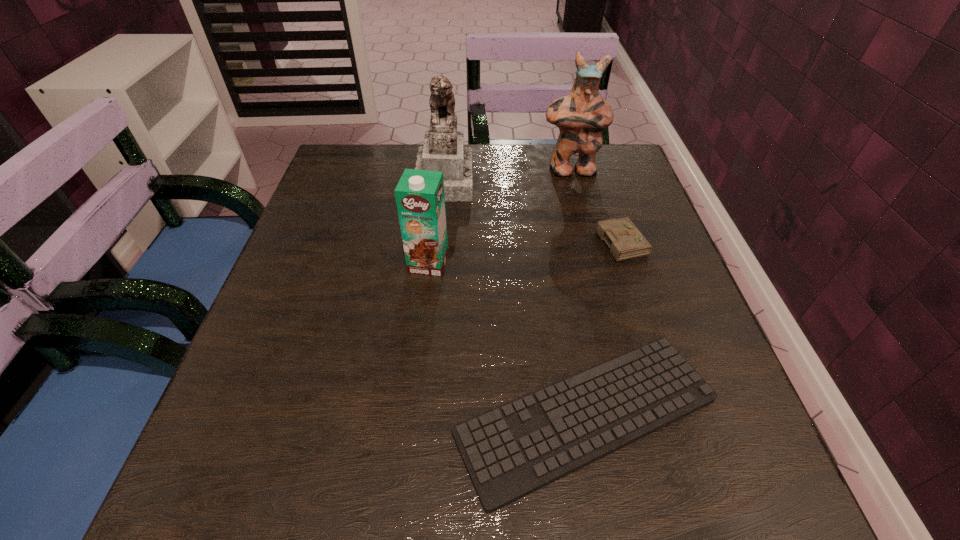
Locate an element on the screen. Image resolution: width=960 pixels, height=540 pixels. free space between the computer keyboard and the left figurine is located at coordinates (516, 297).

Identify which object is located as the second nearest to the right figurine. Please provide its 2D coordinates. Your answer should be formatted as a tuple, i.e. [(x, y)], where the tuple contains the x and y coordinates of a point satisfying the conditions above.

[(443, 150)]

Where is `the second closest object to the right figurine`? Image resolution: width=960 pixels, height=540 pixels. the second closest object to the right figurine is located at coordinates (443, 150).

Image resolution: width=960 pixels, height=540 pixels. Identify the location of vacant space that satisfies the following two spatial constraints: 1. on the back side of the fourth tallest object; 2. on the front-facing side of the left figurine. (600, 179).

I want to click on vacant space that satisfies the following two spatial constraints: 1. on the front-facing side of the left figurine; 2. on the right side of the shortest object, so click(420, 416).

At what (x,y) coordinates should I click in order to perform the action: click on free space that satisfies the following two spatial constraints: 1. on the front-facing side of the left figurine; 2. on the left side of the shortest object. Please return your answer as a coordinate pair (x, y). Looking at the image, I should click on (420, 416).